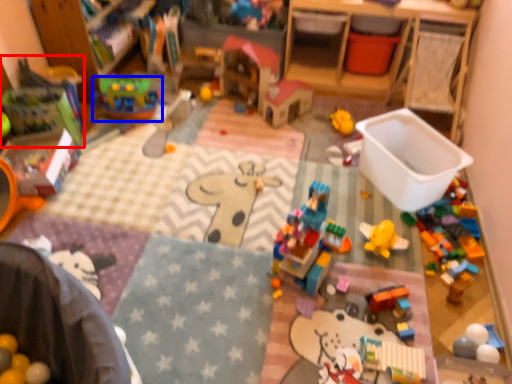
Question: Which object is further to the camera taking this photo, toy (highlighted by a red box) or toy (highlighted by a blue box)?

Choices:
 (A) toy
 (B) toy

Answer: (B)